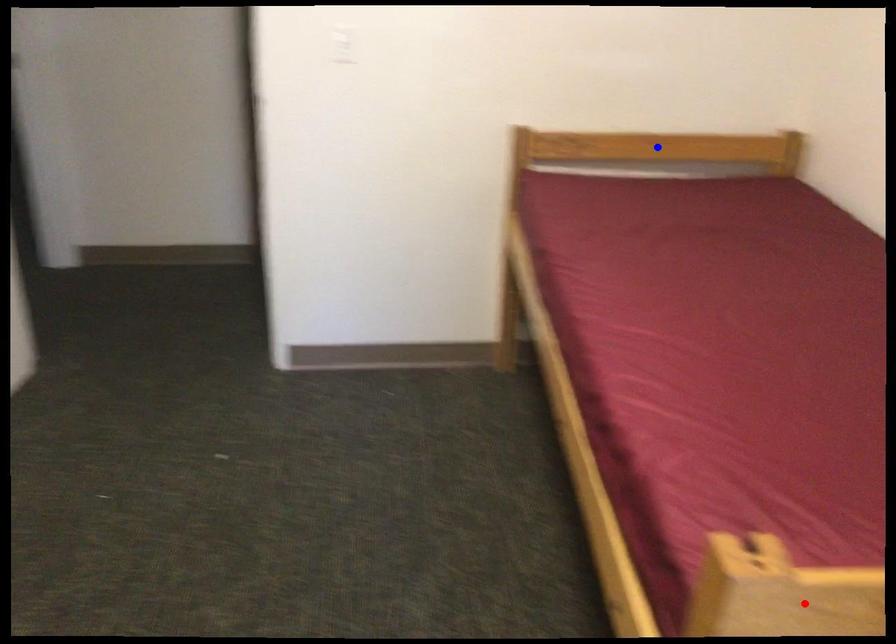
Question: Two points are marked on the image. Which point is closer to the camera?

Choices:
 (A) Blue point is closer.
 (B) Red point is closer.

Answer: (B)